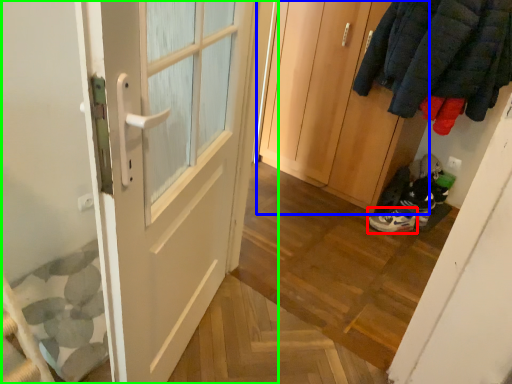
Question: Which object is the farthest from footwear (highlighted by a red box)? Choose among these: door (highlighted by a blue box) or door (highlighted by a green box).

Choices:
 (A) door
 (B) door

Answer: (B)